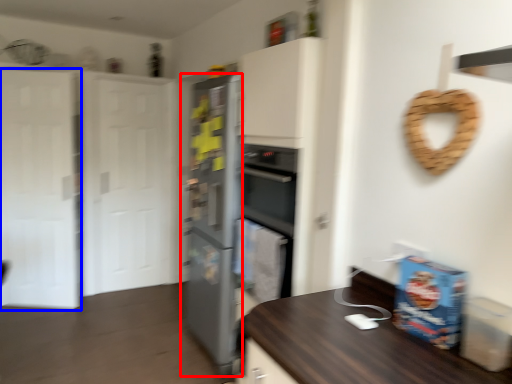
Question: Which point is further to the camera, refrigerator (highlighted by a red box) or glass door (highlighted by a blue box)?

Choices:
 (A) refrigerator
 (B) glass door

Answer: (B)